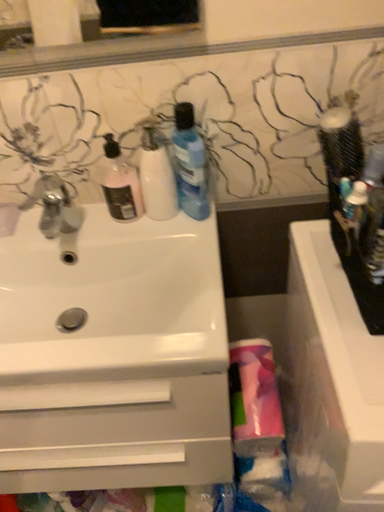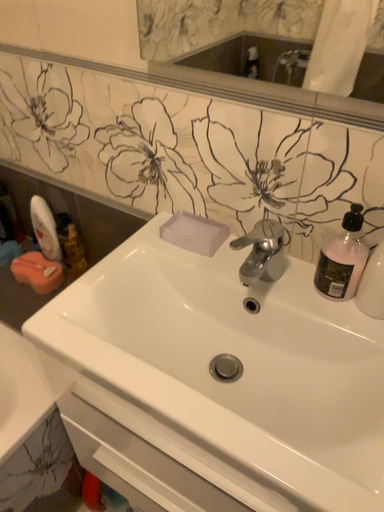
Question: Which way did the camera rotate in the video?

Choices:
 (A) rotated left
 (B) rotated right

Answer: (A)